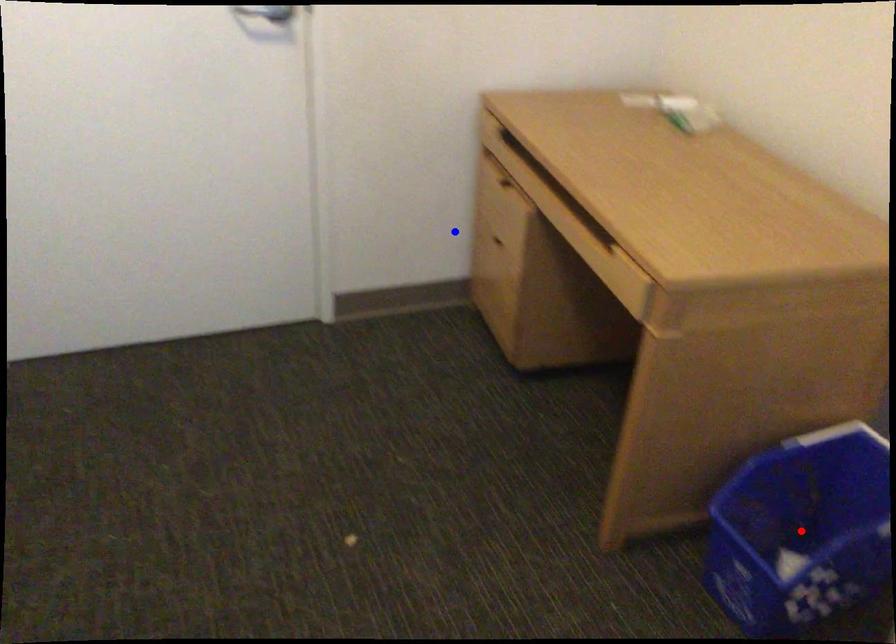
Question: Which of the two points in the image is closer to the camera?

Choices:
 (A) Blue point is closer.
 (B) Red point is closer.

Answer: (B)